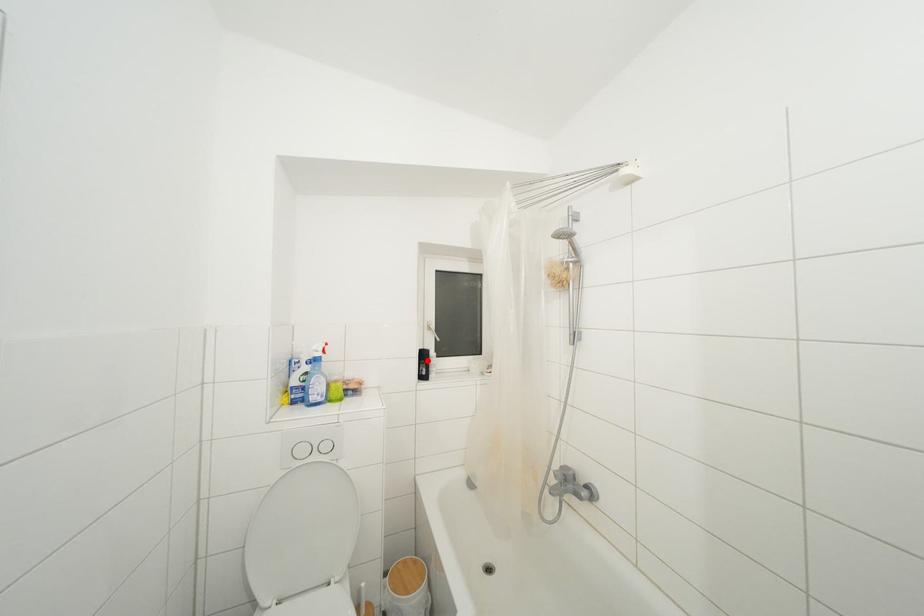
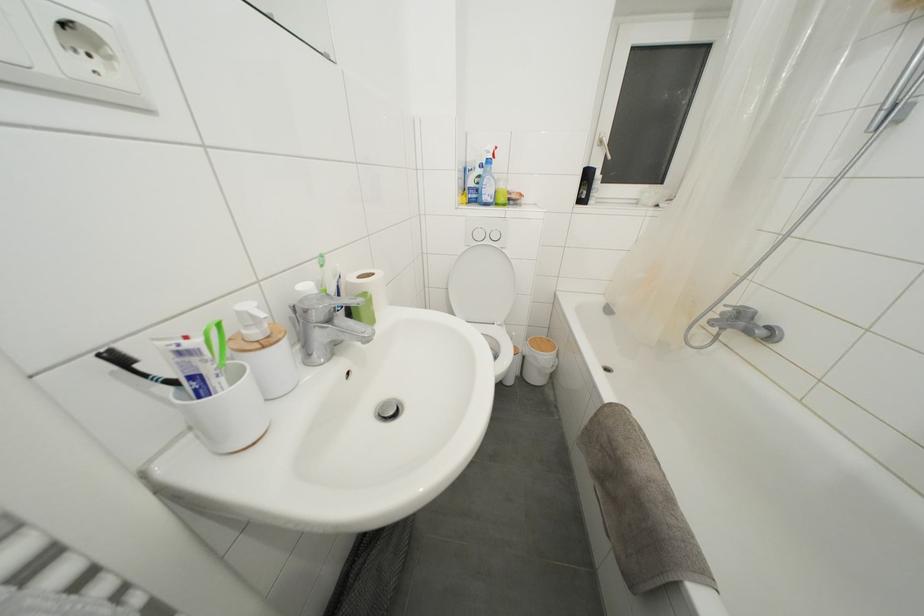
Question: I am providing you with two images of the same scene from different viewpoints. A red point is marked on the first image. Can you still see the location of the red point in image 2?

Choices:
 (A) Yes
 (B) No

Answer: (A)